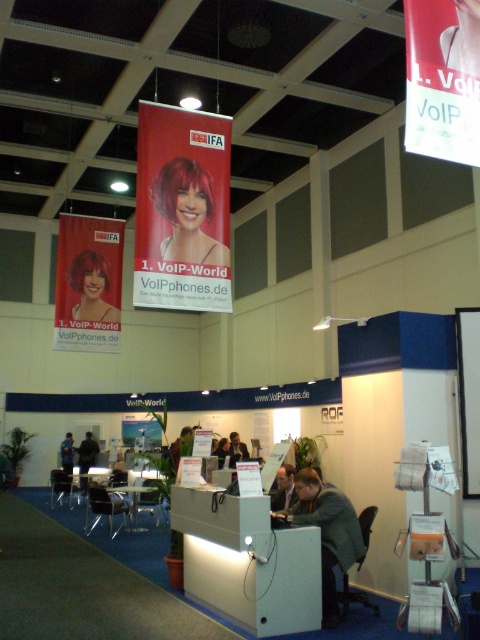
You are at a trade show booth and notice two elements in the upper part of the booth area. One is the white paper at upper center and the other is the matte red hair at upper left. From your perspective facing the booth, which of these two items is positioned more to the right?

The white paper at upper center is positioned to the right of the matte red hair at upper left, so it is more to the right.

You are standing in the exhibition hall and want to take a photo of the shiny red hair at center without moving closer. Can you do it with a standard smartphone camera? Explain why or why not.

The shiny red hair at center and the viewer are 6.87 meters apart. A standard smartphone camera has a maximum focus range of about 10 meters, so it should be possible to take a clear photo without moving closer.